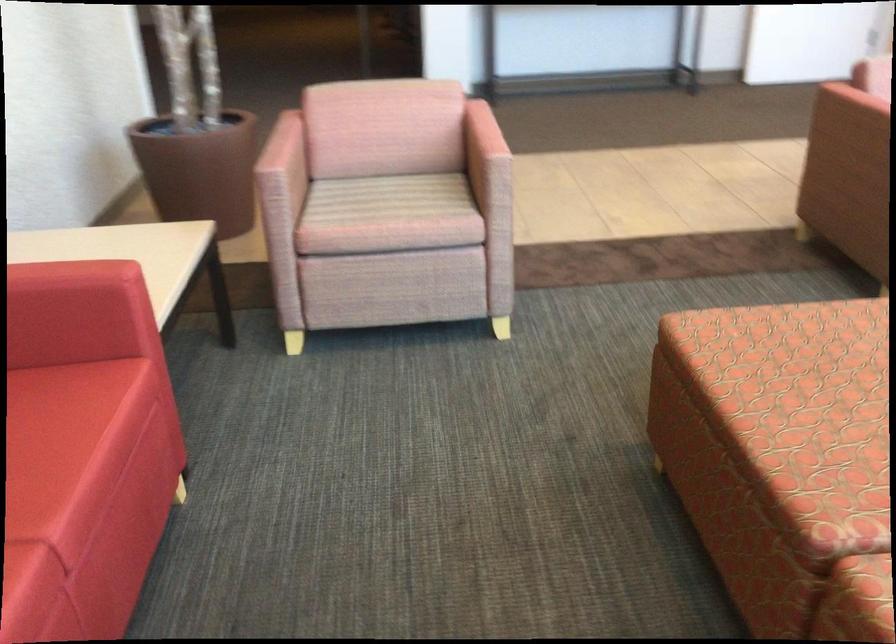
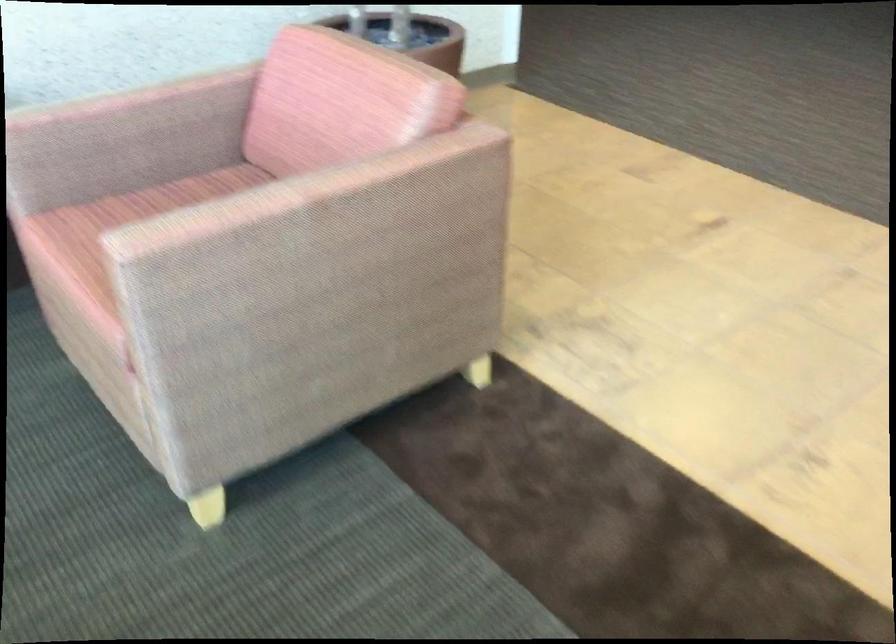
Where in the second image is the point corresponding to point 493,122 from the first image?

(298, 192)